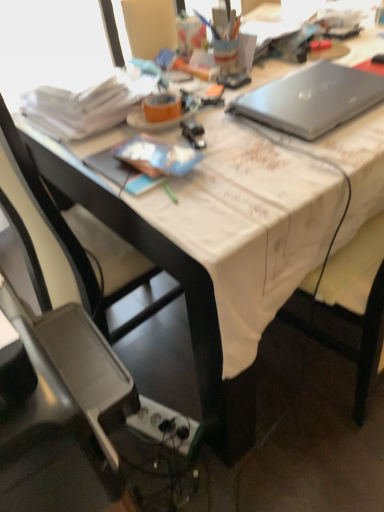
You are a GUI agent. You are given a task and a screenshot of the screen. Output one action in this format:
    pyautogui.click(x=<x>, y=<y>)
    Task: Click on the vacant space in front of silver metallic laptop at upper right
    Image resolution: width=384 pixels, height=512 pixels.
    Given the screenshot: What is the action you would take?
    pyautogui.click(x=313, y=155)